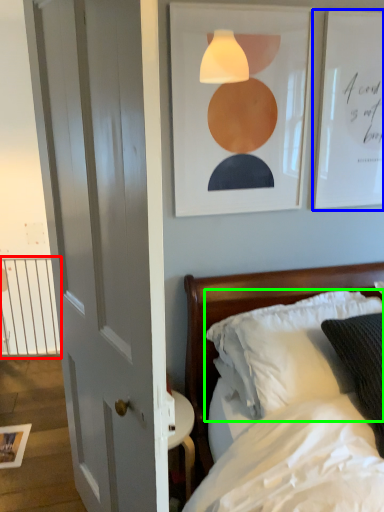
Question: Which object is the closest to the balustrade (highlighted by a red box)? Choose among these: picture frame (highlighted by a blue box) or pillow (highlighted by a green box).

Choices:
 (A) picture frame
 (B) pillow

Answer: (B)